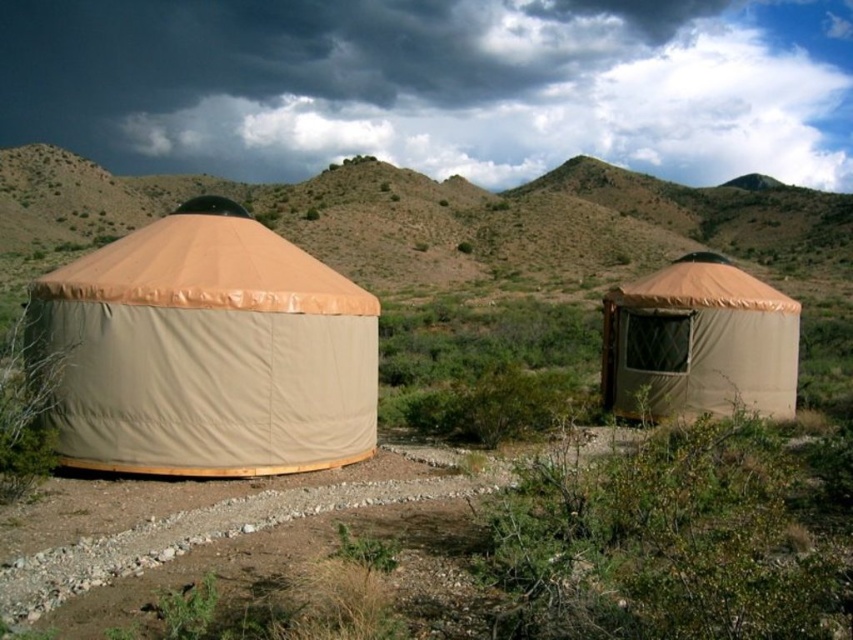
Is point (102, 282) closer to camera compared to point (641, 323)?

Yes.

Does tan canvas yurt at left appear on the right side of tan canvas yurt at right?

Incorrect, tan canvas yurt at left is not on the right side of tan canvas yurt at right.

Does point (56, 413) come behind point (729, 365)?

No.

I want to click on tan canvas yurt at left, so click(207, 352).

Is brown textured tent at upper center to the right of tan canvas yurt at right from the viewer's perspective?

In fact, brown textured tent at upper center is to the left of tan canvas yurt at right.

Between point (619, 184) and point (769, 308), which one is positioned behind?

The point (619, 184) is more distant.

The height and width of the screenshot is (640, 853). In order to click on brown textured tent at upper center in this screenshot , I will do `click(450, 220)`.

Which is more to the left, tan canvas yurt at left or brown textured tent at upper center?

From the viewer's perspective, brown textured tent at upper center appears more on the left side.

The image size is (853, 640). Find the location of `tan canvas yurt at left`. tan canvas yurt at left is located at coordinates (207, 352).

Where is `tan canvas yurt at left`? tan canvas yurt at left is located at coordinates (207, 352).